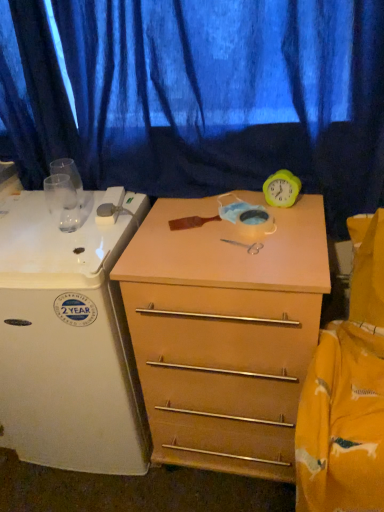
Question: Is blue fabric curtain at upper center at the left side of light wood/finish chest of drawers at center?

Choices:
 (A) no
 (B) yes

Answer: (B)

Question: Is blue fabric curtain at upper center closer to camera compared to light wood/finish chest of drawers at center?

Choices:
 (A) yes
 (B) no

Answer: (B)

Question: Is light wood/finish chest of drawers at center inside blue fabric curtain at upper center?

Choices:
 (A) no
 (B) yes

Answer: (A)

Question: Is blue fabric curtain at upper center at the right side of light wood/finish chest of drawers at center?

Choices:
 (A) no
 (B) yes

Answer: (A)

Question: Considering the relative sizes of blue fabric curtain at upper center and light wood/finish chest of drawers at center in the image provided, is blue fabric curtain at upper center thinner than light wood/finish chest of drawers at center?

Choices:
 (A) no
 (B) yes

Answer: (B)

Question: Based on their positions, is light wood/finish chest of drawers at center located to the left or right of white glossy refrigerator at left?

Choices:
 (A) left
 (B) right

Answer: (B)

Question: From a real-world perspective, is light wood/finish chest of drawers at center positioned above or below white glossy refrigerator at left?

Choices:
 (A) above
 (B) below

Answer: (B)

Question: From the image's perspective, is light wood/finish chest of drawers at center above or below white glossy refrigerator at left?

Choices:
 (A) below
 (B) above

Answer: (A)

Question: Considering the positions of light wood/finish chest of drawers at center and white glossy refrigerator at left in the image, is light wood/finish chest of drawers at center wider or thinner than white glossy refrigerator at left?

Choices:
 (A) wide
 (B) thin

Answer: (B)

Question: Is light wood/finish chest of drawers at center inside or outside of blue fabric curtain at upper center?

Choices:
 (A) outside
 (B) inside

Answer: (A)

Question: In the image, is light wood/finish chest of drawers at center on the left side or the right side of blue fabric curtain at upper center?

Choices:
 (A) right
 (B) left

Answer: (A)

Question: Relative to blue fabric curtain at upper center, is light wood/finish chest of drawers at center in front or behind?

Choices:
 (A) front
 (B) behind

Answer: (A)

Question: Is point (198, 207) closer or farther from the camera than point (251, 98)?

Choices:
 (A) farther
 (B) closer

Answer: (A)

Question: Is white glossy refrigerator at left spatially inside light wood/finish chest of drawers at center, or outside of it?

Choices:
 (A) outside
 (B) inside

Answer: (A)

Question: Is white glossy refrigerator at left wider or thinner than light wood/finish chest of drawers at center?

Choices:
 (A) wide
 (B) thin

Answer: (A)